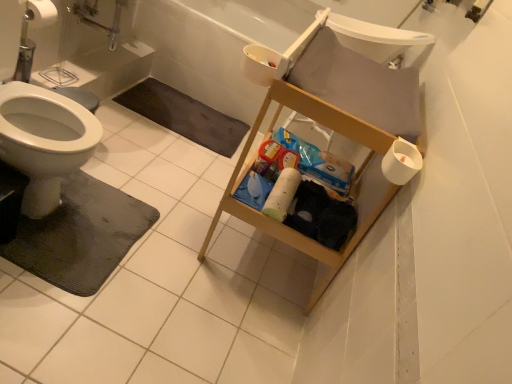
Identify the location of free point above black rubber bath mat at lower left, acting as the 2th bath mat starting from the bottom (from a real-world perspective). This screenshot has width=512, height=384. (210, 118).